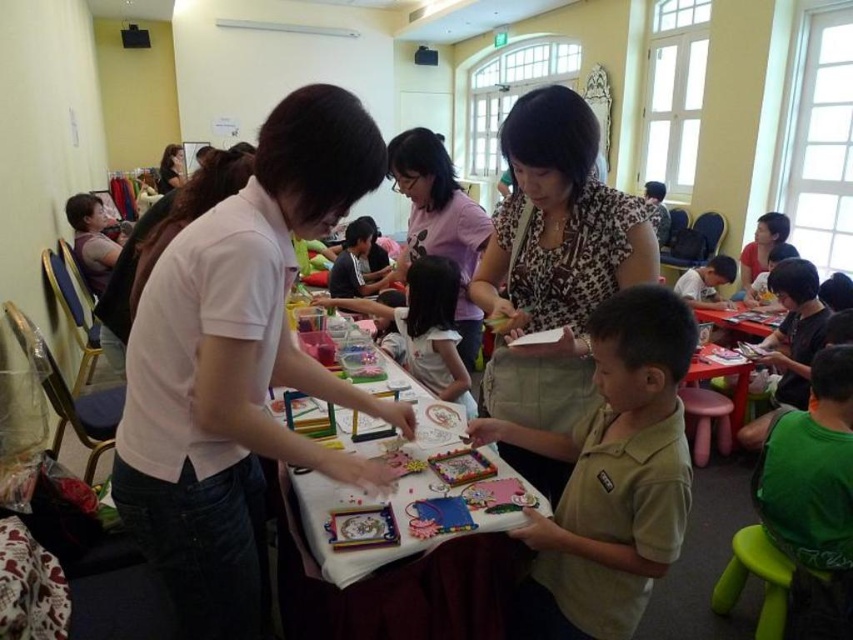
Is point (558, 531) positioned in front of point (732, 552)?

Yes.

Is light brown cotton shirt at center shorter than green plastic stool at lower right?

No.

Image resolution: width=853 pixels, height=640 pixels. I want to click on light brown cotton shirt at center, so click(611, 476).

Is printed fabric shirt at center above white paper at center?

Yes, printed fabric shirt at center is above white paper at center.

Is printed fabric shirt at center thinner than white paper at center?

Correct, printed fabric shirt at center's width is less than white paper at center's.

The image size is (853, 640). What do you see at coordinates (554, 259) in the screenshot? I see `printed fabric shirt at center` at bounding box center [554, 259].

The width and height of the screenshot is (853, 640). Find the location of `printed fabric shirt at center`. printed fabric shirt at center is located at coordinates (554, 259).

Is green plastic stool at lower right positioned behind pink plastic stool at lower right?

No, it is in front of pink plastic stool at lower right.

Is green plastic stool at lower right in front of pink plastic stool at lower right?

Yes, green plastic stool at lower right is in front of pink plastic stool at lower right.

Between point (724, 593) and point (706, 449), which one is positioned in front?

Point (724, 593) is in front.

Find the location of `green plastic stool at lower right`. green plastic stool at lower right is located at coordinates (756, 577).